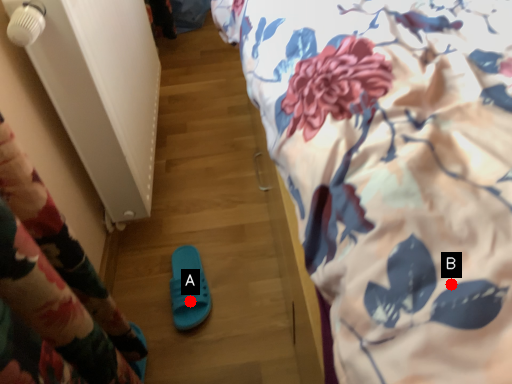
Question: Two points are circled on the image, labeled by A and B beside each circle. Which point appears farthest from the camera in this image?

Choices:
 (A) A is further
 (B) B is further

Answer: (A)